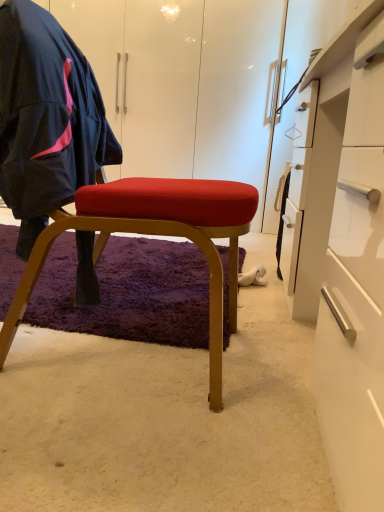
Question: Considering the relative sizes of matte gold stool at center and matte black jacket at left in the image provided, is matte gold stool at center smaller than matte black jacket at left?

Choices:
 (A) yes
 (B) no

Answer: (B)

Question: From a real-world perspective, is matte gold stool at center located beneath matte black jacket at left?

Choices:
 (A) no
 (B) yes

Answer: (B)

Question: Can you confirm if matte gold stool at center is shorter than matte black jacket at left?

Choices:
 (A) yes
 (B) no

Answer: (B)

Question: Is matte gold stool at center thinner than matte black jacket at left?

Choices:
 (A) no
 (B) yes

Answer: (A)

Question: Is matte gold stool at center facing towards matte black jacket at left?

Choices:
 (A) yes
 (B) no

Answer: (A)

Question: Is matte black jacket at left inside matte gold stool at center?

Choices:
 (A) yes
 (B) no

Answer: (A)

Question: Is white suede shoe at lower center thinner than matte black jacket at left?

Choices:
 (A) yes
 (B) no

Answer: (A)

Question: Are white suede shoe at lower center and matte black jacket at left located far from each other?

Choices:
 (A) no
 (B) yes

Answer: (A)

Question: Does white suede shoe at lower center have a lesser height compared to matte black jacket at left?

Choices:
 (A) yes
 (B) no

Answer: (A)

Question: From a real-world perspective, is white suede shoe at lower center physically below matte black jacket at left?

Choices:
 (A) no
 (B) yes

Answer: (B)

Question: Does white suede shoe at lower center have a greater height compared to matte black jacket at left?

Choices:
 (A) no
 (B) yes

Answer: (A)

Question: Is white suede shoe at lower center oriented away from matte black jacket at left?

Choices:
 (A) no
 (B) yes

Answer: (A)

Question: Does white suede shoe at lower center have a lesser width compared to white glossy desk at center right?

Choices:
 (A) yes
 (B) no

Answer: (A)